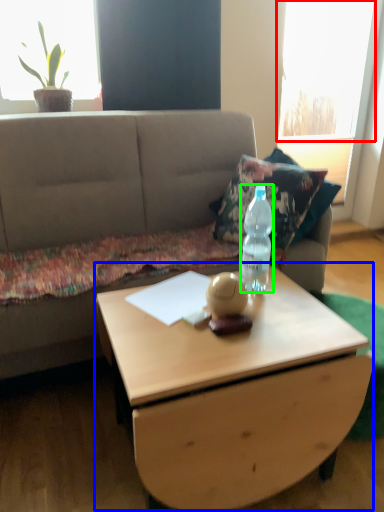
Question: Which object is positioned farthest from window (highlighted by a red box)? Select from coffee table (highlighted by a blue box) and bottle (highlighted by a green box).

Choices:
 (A) coffee table
 (B) bottle

Answer: (A)